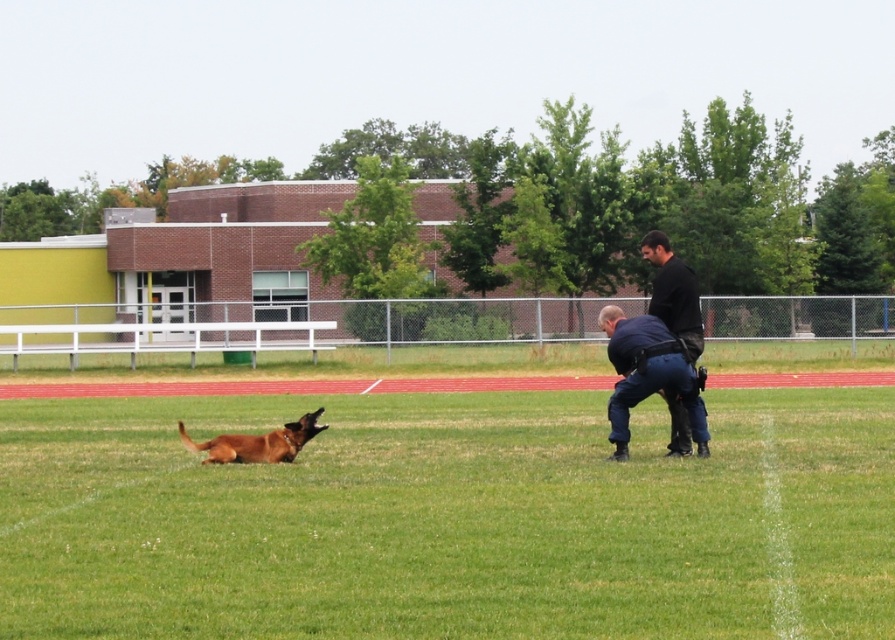
Question: Is green grass at center smaller than dark blue uniform at center?

Choices:
 (A) yes
 (B) no

Answer: (B)

Question: Can you confirm if brown matte dog at lower left is positioned to the left of brown furry dog at lower left?

Choices:
 (A) no
 (B) yes

Answer: (A)

Question: Which object is the closest to the brown furry dog at lower left?

Choices:
 (A) green grass at center
 (B) dark blue uniform at center

Answer: (B)

Question: Which of the following is the farthest from the observer?

Choices:
 (A) dark blue uniform at center
 (B) black smooth shirt at center

Answer: (B)

Question: Which is farther from the brown matte dog at lower left?

Choices:
 (A) green grass at center
 (B) brown furry dog at lower left
 (C) black smooth shirt at center

Answer: (A)

Question: Is brown matte dog at lower left positioned at the back of brown furry dog at lower left?

Choices:
 (A) no
 (B) yes

Answer: (A)